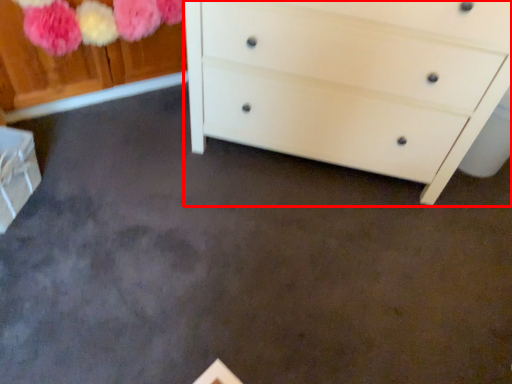
Question: Considering the relative positions of chest of drawers (annotated by the red box) and cabinetry in the image provided, where is chest of drawers (annotated by the red box) located with respect to the staircase?

Choices:
 (A) right
 (B) left

Answer: (A)